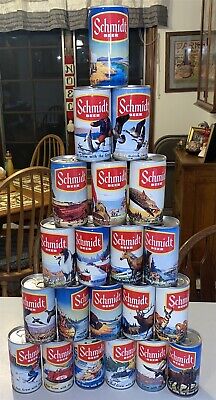
This screenshot has width=216, height=400. Find the location of `wall`. wall is located at coordinates (177, 110).